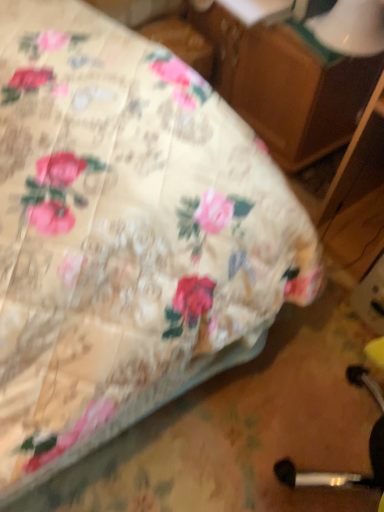
Describe the element at coordinates (288, 84) in the screenshot. This screenshot has height=512, width=384. I see `wooden dresser at upper right` at that location.

This screenshot has height=512, width=384. I want to click on wooden dresser at upper right, so click(x=288, y=84).

Locate an element on the screen. The image size is (384, 512). wooden dresser at upper right is located at coordinates (288, 84).